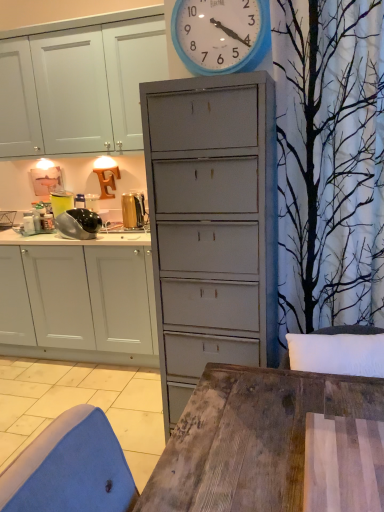
What do you see at coordinates (79, 223) in the screenshot? This screenshot has height=512, width=384. I see `shiny metallic food processor at left, the first appliance when ordered from left to right` at bounding box center [79, 223].

Image resolution: width=384 pixels, height=512 pixels. What do you see at coordinates (221, 34) in the screenshot?
I see `blue plastic wall clock at upper center` at bounding box center [221, 34].

Measure the distance between blue plastic wall clock at upper center and camera.

blue plastic wall clock at upper center and camera are 1.42 meters apart from each other.

The image size is (384, 512). What are the coordinates of `white matte cabinet at left` in the screenshot? It's located at (78, 298).

Where is `gold metallic toaster at upper left, acting as the 2th appliance starting from the left`? The height and width of the screenshot is (512, 384). gold metallic toaster at upper left, acting as the 2th appliance starting from the left is located at coordinates (133, 210).

The width and height of the screenshot is (384, 512). Identify the location of shiny metallic food processor at left, which appears as the second appliance when viewed from the right. (79, 223).

Considering the positions of objects gold metallic toaster at upper left, which is counted as the first appliance, starting from the right, and shiny metallic food processor at left, the first appliance when ordered from left to right, in the image provided, who is more to the left, gold metallic toaster at upper left, which is counted as the first appliance, starting from the right, or shiny metallic food processor at left, the first appliance when ordered from left to right,?

shiny metallic food processor at left, the first appliance when ordered from left to right.

Looking at this image, how many degrees apart are the facing directions of gold metallic toaster at upper left, which is counted as the first appliance, starting from the right, and shiny metallic food processor at left, the first appliance when ordered from left to right?

The facing directions of gold metallic toaster at upper left, which is counted as the first appliance, starting from the right, and shiny metallic food processor at left, the first appliance when ordered from left to right, are 0.00246 degrees apart.

From a real-world perspective, is gold metallic toaster at upper left, which is counted as the first appliance, starting from the right, positioned above or below shiny metallic food processor at left, which appears as the second appliance when viewed from the right?

gold metallic toaster at upper left, which is counted as the first appliance, starting from the right, is above shiny metallic food processor at left, which appears as the second appliance when viewed from the right.

Is gold metallic toaster at upper left, acting as the 2th appliance starting from the left, completely or partially outside of shiny metallic food processor at left, the first appliance when ordered from left to right?

Yes, gold metallic toaster at upper left, acting as the 2th appliance starting from the left, is outside of shiny metallic food processor at left, the first appliance when ordered from left to right.

Which of these two, white matte cabinet at left or blue plastic wall clock at upper center, stands shorter?

blue plastic wall clock at upper center is shorter.

Considering the positions of objects white matte cabinet at left and blue plastic wall clock at upper center in the image provided, who is more to the left, white matte cabinet at left or blue plastic wall clock at upper center?

white matte cabinet at left.

You are a GUI agent. You are given a task and a screenshot of the screen. Output one action in this format:
    pyautogui.click(x=<x>, y=<y>)
    Task: Click on the cabinetry to the left of blue plastic wall clock at upper center
    This screenshot has height=512, width=384.
    Given the screenshot: What is the action you would take?
    pyautogui.click(x=78, y=298)

Does white matte cabinet at left turn towards blue plastic wall clock at upper center?

No, white matte cabinet at left does not turn towards blue plastic wall clock at upper center.

From the image's perspective, who appears lower, shiny metallic food processor at left, which appears as the second appliance when viewed from the right, or gold metallic toaster at upper left, acting as the 2th appliance starting from the left?

shiny metallic food processor at left, which appears as the second appliance when viewed from the right, is shown below in the image.

Based on their sizes in the image, would you say shiny metallic food processor at left, the first appliance when ordered from left to right, is bigger or smaller than gold metallic toaster at upper left, which is counted as the first appliance, starting from the right?

Considering their sizes, shiny metallic food processor at left, the first appliance when ordered from left to right, takes up more space than gold metallic toaster at upper left, which is counted as the first appliance, starting from the right.

Is shiny metallic food processor at left, the first appliance when ordered from left to right, at the right side of gold metallic toaster at upper left, acting as the 2th appliance starting from the left?

In fact, shiny metallic food processor at left, the first appliance when ordered from left to right, is to the left of gold metallic toaster at upper left, acting as the 2th appliance starting from the left.

From a real-world perspective, who is located lower, shiny metallic food processor at left, which appears as the second appliance when viewed from the right, or gold metallic toaster at upper left, which is counted as the first appliance, starting from the right?

shiny metallic food processor at left, which appears as the second appliance when viewed from the right, from a real-world perspective.

From their relative heights in the image, would you say shiny metallic food processor at left, the first appliance when ordered from left to right, is taller or shorter than blue plastic wall clock at upper center?

Clearly, shiny metallic food processor at left, the first appliance when ordered from left to right, is shorter compared to blue plastic wall clock at upper center.

How many degrees apart are the facing directions of shiny metallic food processor at left, which appears as the second appliance when viewed from the right, and blue plastic wall clock at upper center?

shiny metallic food processor at left, which appears as the second appliance when viewed from the right, and blue plastic wall clock at upper center are facing 0.0051 degrees away from each other.

Is shiny metallic food processor at left, which appears as the second appliance when viewed from the right, wider than blue plastic wall clock at upper center?

Yes.

From the image's perspective, does shiny metallic food processor at left, which appears as the second appliance when viewed from the right, appear lower than blue plastic wall clock at upper center?

Indeed, from the image's perspective, shiny metallic food processor at left, which appears as the second appliance when viewed from the right, is shown beneath blue plastic wall clock at upper center.

Is white matte cabinet at left beside shiny metallic food processor at left, the first appliance when ordered from left to right?

white matte cabinet at left and shiny metallic food processor at left, the first appliance when ordered from left to right, are clearly separated.

Could you tell me if white matte cabinet at left is turned towards shiny metallic food processor at left, the first appliance when ordered from left to right?

No.

From the picture: Considering the positions of objects white matte cabinet at left and shiny metallic food processor at left, which appears as the second appliance when viewed from the right, in the image provided, who is more to the left, white matte cabinet at left or shiny metallic food processor at left, which appears as the second appliance when viewed from the right,?

white matte cabinet at left.

Which object is wider, white matte cabinet at left or shiny metallic food processor at left, the first appliance when ordered from left to right?

Wider between the two is white matte cabinet at left.

Is gold metallic toaster at upper left, which is counted as the first appliance, starting from the right, bigger than white matte cabinet at left?

No.

From a real-world perspective, is gold metallic toaster at upper left, which is counted as the first appliance, starting from the right, over white matte cabinet at left?

Yes, from a real-world perspective, gold metallic toaster at upper left, which is counted as the first appliance, starting from the right, is over white matte cabinet at left

Is gold metallic toaster at upper left, acting as the 2th appliance starting from the left, not near white matte cabinet at left?

No, gold metallic toaster at upper left, acting as the 2th appliance starting from the left, is not far away from white matte cabinet at left.

Is gold metallic toaster at upper left, which is counted as the first appliance, starting from the right, positioned beyond the bounds of white matte cabinet at left?

Indeed, gold metallic toaster at upper left, which is counted as the first appliance, starting from the right, is completely outside white matte cabinet at left.

Can gold metallic toaster at upper left, acting as the 2th appliance starting from the left, be found inside white matte cabinet at left?

No.

Based on the photo, can you tell me how much white matte cabinet at left and gold metallic toaster at upper left, acting as the 2th appliance starting from the left, differ in facing direction?

white matte cabinet at left and gold metallic toaster at upper left, acting as the 2th appliance starting from the left, are facing 1.24 degrees away from each other.

Between white matte cabinet at left and gold metallic toaster at upper left, acting as the 2th appliance starting from the left, which one has larger size?

white matte cabinet at left is bigger.

Does white matte cabinet at left have a lesser width compared to gold metallic toaster at upper left, which is counted as the first appliance, starting from the right?

No.

Locate an element on the screen. appliance behind the shiny metallic food processor at left, the first appliance when ordered from left to right is located at coordinates click(133, 210).

Identify the location of cabinetry directly beneath the blue plastic wall clock at upper center (from a real-world perspective). The width and height of the screenshot is (384, 512). (78, 298).

From the image, which object appears to be farther from gold metallic toaster at upper left, which is counted as the first appliance, starting from the right, white matte cabinet at left or blue plastic wall clock at upper center?

blue plastic wall clock at upper center is further to gold metallic toaster at upper left, which is counted as the first appliance, starting from the right.

When comparing their distances from gold metallic toaster at upper left, which is counted as the first appliance, starting from the right, does shiny metallic food processor at left, which appears as the second appliance when viewed from the right, or blue plastic wall clock at upper center seem closer?

The object closer to gold metallic toaster at upper left, which is counted as the first appliance, starting from the right, is shiny metallic food processor at left, which appears as the second appliance when viewed from the right.

When comparing their distances from shiny metallic food processor at left, the first appliance when ordered from left to right, does gold metallic toaster at upper left, acting as the 2th appliance starting from the left, or white matte cabinet at left seem further?

The object further to shiny metallic food processor at left, the first appliance when ordered from left to right, is white matte cabinet at left.

Considering their positions, is gold metallic toaster at upper left, acting as the 2th appliance starting from the left, positioned further to blue plastic wall clock at upper center than shiny metallic food processor at left, which appears as the second appliance when viewed from the right?

gold metallic toaster at upper left, acting as the 2th appliance starting from the left, is positioned further to the anchor blue plastic wall clock at upper center.

Estimate the real-world distances between objects in this image. Which object is further from shiny metallic food processor at left, which appears as the second appliance when viewed from the right, gold metallic toaster at upper left, which is counted as the first appliance, starting from the right, or blue plastic wall clock at upper center?

Among the two, blue plastic wall clock at upper center is located further to shiny metallic food processor at left, which appears as the second appliance when viewed from the right.

From the image, which object appears to be farther from blue plastic wall clock at upper center, shiny metallic food processor at left, the first appliance when ordered from left to right, or gold metallic toaster at upper left, acting as the 2th appliance starting from the left?

Based on the image, gold metallic toaster at upper left, acting as the 2th appliance starting from the left, appears to be further to blue plastic wall clock at upper center.

In the scene shown: From the image, which object appears to be farther from white matte cabinet at left, shiny metallic food processor at left, which appears as the second appliance when viewed from the right, or gold metallic toaster at upper left, acting as the 2th appliance starting from the left?

gold metallic toaster at upper left, acting as the 2th appliance starting from the left, is further to white matte cabinet at left.

Which object lies nearer to the anchor point white matte cabinet at left, gold metallic toaster at upper left, acting as the 2th appliance starting from the left, or shiny metallic food processor at left, which appears as the second appliance when viewed from the right?

shiny metallic food processor at left, which appears as the second appliance when viewed from the right.

Locate an element on the screen. Image resolution: width=384 pixels, height=512 pixels. appliance between blue plastic wall clock at upper center and gold metallic toaster at upper left, which is counted as the first appliance, starting from the right, in the front-back direction is located at coordinates (79, 223).

Where is `cabinetry between blue plastic wall clock at upper center and gold metallic toaster at upper left, acting as the 2th appliance starting from the left, along the z-axis`? The width and height of the screenshot is (384, 512). cabinetry between blue plastic wall clock at upper center and gold metallic toaster at upper left, acting as the 2th appliance starting from the left, along the z-axis is located at coordinates (78, 298).

The height and width of the screenshot is (512, 384). I want to click on appliance between gold metallic toaster at upper left, acting as the 2th appliance starting from the left, and white matte cabinet at left from top to bottom, so click(79, 223).

The image size is (384, 512). Identify the location of cabinetry between blue plastic wall clock at upper center and shiny metallic food processor at left, the first appliance when ordered from left to right, from front to back. (78, 298).